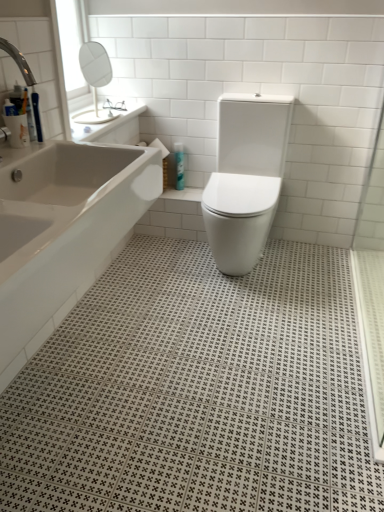
Question: Can you confirm if white glossy toilet at center is smaller than blue glossy bottle at center?

Choices:
 (A) yes
 (B) no

Answer: (B)

Question: Does white glossy toilet at center turn towards blue glossy bottle at center?

Choices:
 (A) yes
 (B) no

Answer: (B)

Question: Considering the relative positions of white glossy toilet at center and blue glossy bottle at center in the image provided, is white glossy toilet at center to the right of blue glossy bottle at center from the viewer's perspective?

Choices:
 (A) no
 (B) yes

Answer: (B)

Question: Does white glossy toilet at center appear on the left side of blue glossy bottle at center?

Choices:
 (A) no
 (B) yes

Answer: (A)

Question: From a real-world perspective, is white glossy toilet at center on top of blue glossy bottle at center?

Choices:
 (A) no
 (B) yes

Answer: (B)

Question: From the image's perspective, is blue glossy bottle at center above or below white glossy bathtub at left?

Choices:
 (A) below
 (B) above

Answer: (B)

Question: Relative to white glossy bathtub at left, is blue glossy bottle at center in front or behind?

Choices:
 (A) behind
 (B) front

Answer: (A)

Question: Is point (182, 159) positioned closer to the camera than point (8, 337)?

Choices:
 (A) closer
 (B) farther

Answer: (B)

Question: Would you say blue glossy bottle at center is to the left or to the right of white glossy bathtub at left in the picture?

Choices:
 (A) right
 (B) left

Answer: (A)

Question: Considering the positions of white glossy bathtub at left and white glossy toilet at center in the image, is white glossy bathtub at left wider or thinner than white glossy toilet at center?

Choices:
 (A) wide
 (B) thin

Answer: (B)

Question: Relative to white glossy toilet at center, is white glossy bathtub at left in front or behind?

Choices:
 (A) behind
 (B) front

Answer: (B)

Question: Based on their positions, is white glossy bathtub at left located to the left or right of white glossy toilet at center?

Choices:
 (A) right
 (B) left

Answer: (B)

Question: Is white glossy bathtub at left situated inside white glossy toilet at center or outside?

Choices:
 (A) inside
 (B) outside

Answer: (B)

Question: Visually, is blue glossy bottle at center positioned to the left or to the right of white glossy toilet at center?

Choices:
 (A) left
 (B) right

Answer: (A)

Question: Considering the positions of point (177, 159) and point (241, 162), is point (177, 159) closer or farther from the camera than point (241, 162)?

Choices:
 (A) farther
 (B) closer

Answer: (A)